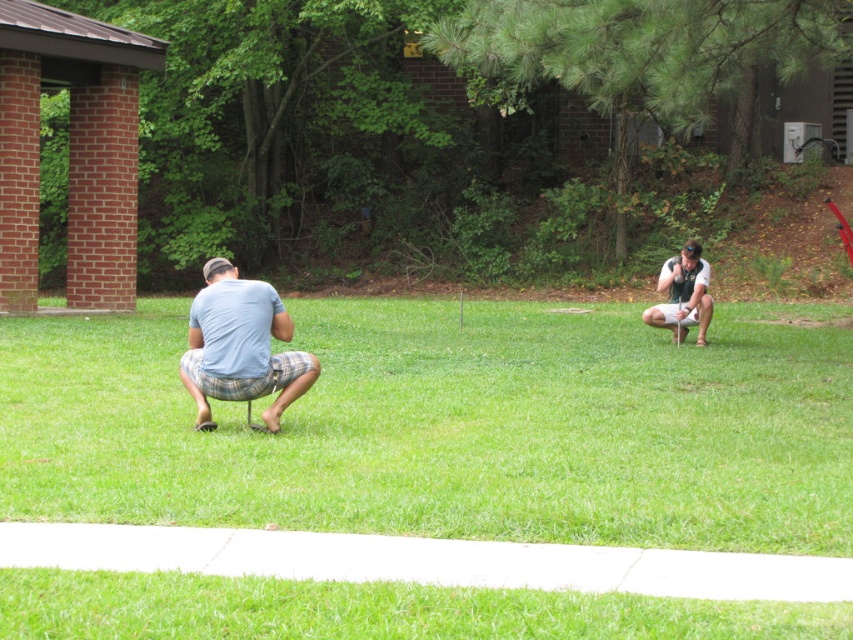
Question: Can you confirm if green grass at center is positioned below light blue cotton shirt at center?

Choices:
 (A) no
 (B) yes

Answer: (B)

Question: Which point is closer to the camera?

Choices:
 (A) (x=698, y=260)
 (B) (x=241, y=346)
 (C) (x=751, y=406)

Answer: (B)

Question: Is the position of green grass at center more distant than that of light blue cotton shirt at center?

Choices:
 (A) no
 (B) yes

Answer: (A)

Question: Which object appears closest to the camera in this image?

Choices:
 (A) light blue cotton shirt at center
 (B) green grass at center
 (C) white matte shirt at right

Answer: (B)

Question: Estimate the real-world distances between objects in this image. Which object is farther from the light blue cotton shirt at center?

Choices:
 (A) white matte shirt at right
 (B) green grass at center

Answer: (A)

Question: Observing the image, what is the correct spatial positioning of light blue cotton shirt at center in reference to white matte shirt at right?

Choices:
 (A) left
 (B) right

Answer: (A)